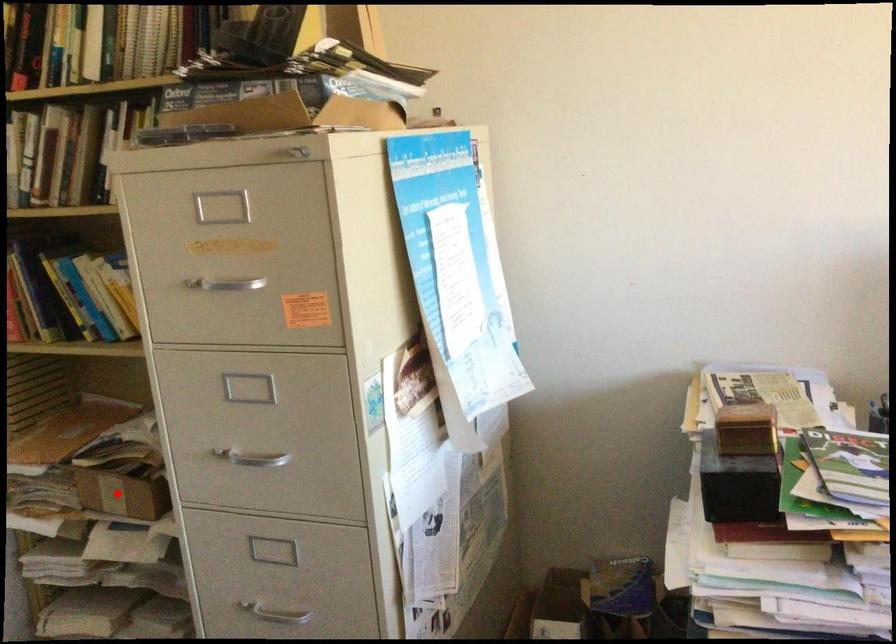
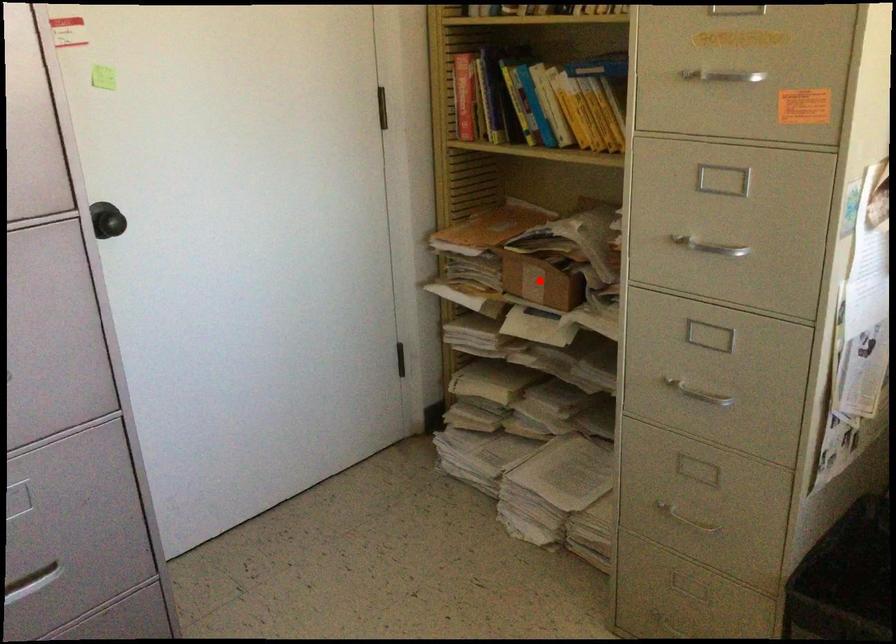
I am providing you with two images of the same scene from different viewpoints. A red point is marked on the first image and another point is marked on the second image. Are the points marked in image1 and image2 representing the same 3D position?

Yes